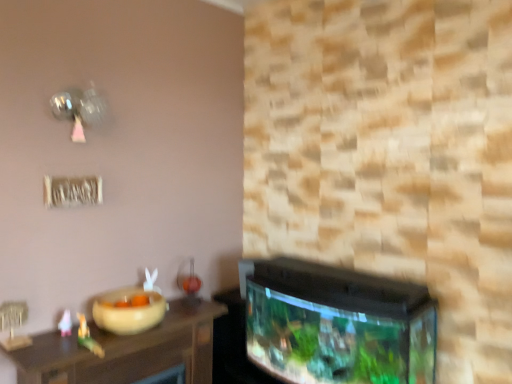
Question: Considering the relative sizes of matte green toy at left, acting as the 1th toy starting from the right, and beige matte bowl at lower left in the image provided, is matte green toy at left, acting as the 1th toy starting from the right, taller than beige matte bowl at lower left?

Choices:
 (A) no
 (B) yes

Answer: (B)

Question: Can beige matte bowl at lower left be found inside matte green toy at left, the 2th toy from the back?

Choices:
 (A) no
 (B) yes

Answer: (A)

Question: Does matte green toy at left, which is the 2th toy from left to right, have a smaller size compared to beige matte bowl at lower left?

Choices:
 (A) yes
 (B) no

Answer: (A)

Question: Is matte green toy at left, which is the 2th toy from left to right, outside of beige matte bowl at lower left?

Choices:
 (A) yes
 (B) no

Answer: (A)

Question: Is matte green toy at left, the 2th toy from the back, placed right next to beige matte bowl at lower left?

Choices:
 (A) no
 (B) yes

Answer: (A)

Question: From a real-world perspective, is matte green toy at left, which is the 2th toy from left to right, over beige matte bowl at lower left?

Choices:
 (A) yes
 (B) no

Answer: (B)

Question: Are beige matte bowl at lower left and wooden table at lower left far apart?

Choices:
 (A) yes
 (B) no

Answer: (B)

Question: Can you confirm if beige matte bowl at lower left is positioned to the left of wooden table at lower left?

Choices:
 (A) yes
 (B) no

Answer: (A)

Question: Can you confirm if beige matte bowl at lower left is taller than wooden table at lower left?

Choices:
 (A) no
 (B) yes

Answer: (B)

Question: Is wooden table at lower left at the back of beige matte bowl at lower left?

Choices:
 (A) yes
 (B) no

Answer: (B)

Question: Considering the relative sizes of beige matte bowl at lower left and wooden table at lower left in the image provided, is beige matte bowl at lower left bigger than wooden table at lower left?

Choices:
 (A) yes
 (B) no

Answer: (B)

Question: Can you confirm if beige matte bowl at lower left is smaller than wooden table at lower left?

Choices:
 (A) no
 (B) yes

Answer: (B)

Question: Is beige matte bowl at lower left further to camera compared to matte green toy at left, the 2th toy from the back?

Choices:
 (A) yes
 (B) no

Answer: (A)